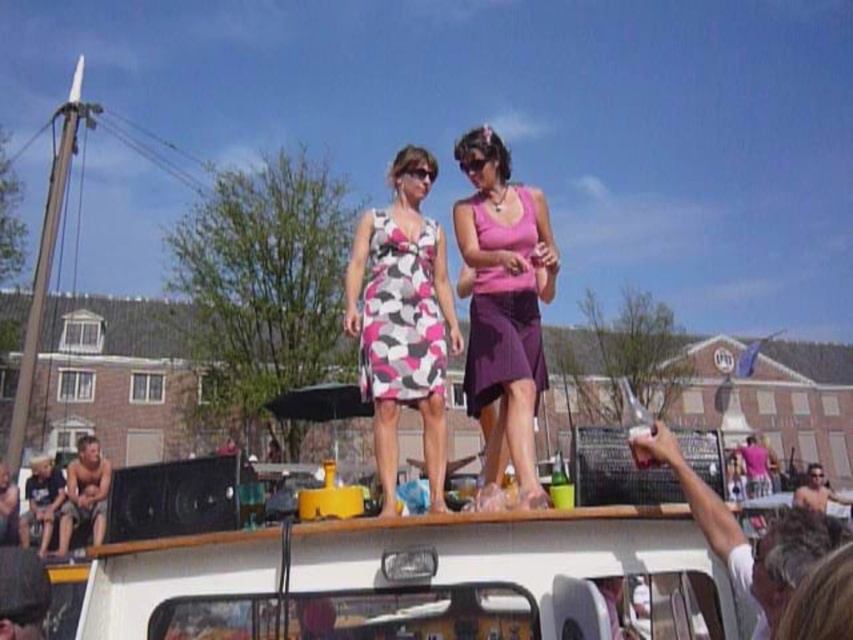
Question: Can you confirm if pink and white patterned dress at center is bigger than white plastic pick up at upper center?

Choices:
 (A) no
 (B) yes

Answer: (B)

Question: Among these objects, which one is nearest to the camera?

Choices:
 (A) white plastic pick up at upper center
 (B) purple satin dress at upper center

Answer: (A)

Question: Which of the following is the closest to the observer?

Choices:
 (A) pink and white patterned dress at center
 (B) purple satin dress at upper center

Answer: (A)

Question: Considering the relative positions of pink matte tank top at upper center and white plastic pick up at upper center in the image provided, where is pink matte tank top at upper center located with respect to white plastic pick up at upper center?

Choices:
 (A) above
 (B) below

Answer: (A)

Question: Which object is the closest to the pink and white patterned dress at center?

Choices:
 (A) white plastic pick up at upper center
 (B) pink and white printed dress at center

Answer: (B)

Question: In this image, where is pink and white printed dress at center located relative to pink matte tank top at upper center?

Choices:
 (A) below
 (B) above

Answer: (A)